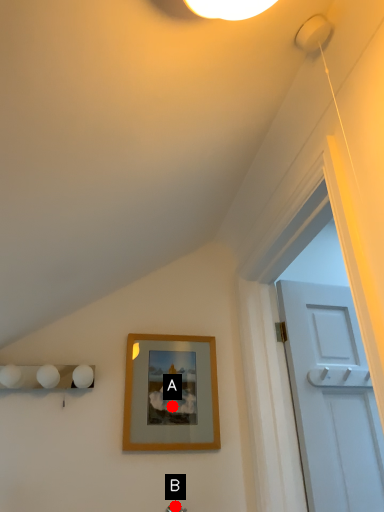
Question: Two points are circled on the image, labeled by A and B beside each circle. Which point is closer to the camera?

Choices:
 (A) A is closer
 (B) B is closer

Answer: (B)